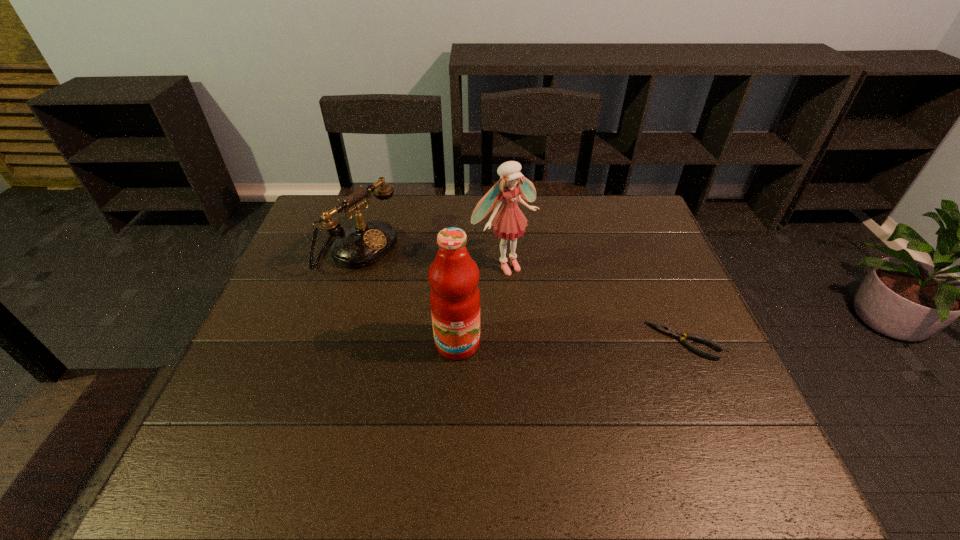
Find the location of a particular element. The width and height of the screenshot is (960, 540). free space on the desktop that is between the fruit juice and the shortest object and is positioned on the dial of the leftmost object is located at coordinates coord(544,342).

At what (x,y) coordinates should I click in order to perform the action: click on vacant space on the desktop that is between the fruit juice and the pliers and is positioned on the front-facing side of the doll. Please return your answer as a coordinate pair (x, y). Image resolution: width=960 pixels, height=540 pixels. Looking at the image, I should click on (585, 342).